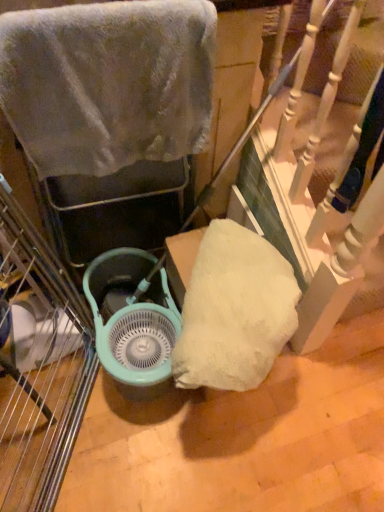
Question: Choose the correct answer: Is fuzzy gray towel at upper left inside teal plastic fan at center or outside it?

Choices:
 (A) inside
 (B) outside

Answer: (B)

Question: Is point (77, 112) positioned closer to the camera than point (173, 331)?

Choices:
 (A) closer
 (B) farther

Answer: (A)

Question: Considering their positions, is fuzzy gray towel at upper left located in front of or behind teal plastic fan at center?

Choices:
 (A) front
 (B) behind

Answer: (A)

Question: Is teal plastic fan at center to the left or to the right of fuzzy gray towel at upper left in the image?

Choices:
 (A) left
 (B) right

Answer: (A)

Question: From the image's perspective, is teal plastic fan at center located above or below fuzzy gray towel at upper left?

Choices:
 (A) above
 (B) below

Answer: (B)

Question: In terms of size, does teal plastic fan at center appear bigger or smaller than fuzzy gray towel at upper left?

Choices:
 (A) small
 (B) big

Answer: (B)

Question: In terms of width, does teal plastic fan at center look wider or thinner when compared to fuzzy gray towel at upper left?

Choices:
 (A) thin
 (B) wide

Answer: (B)